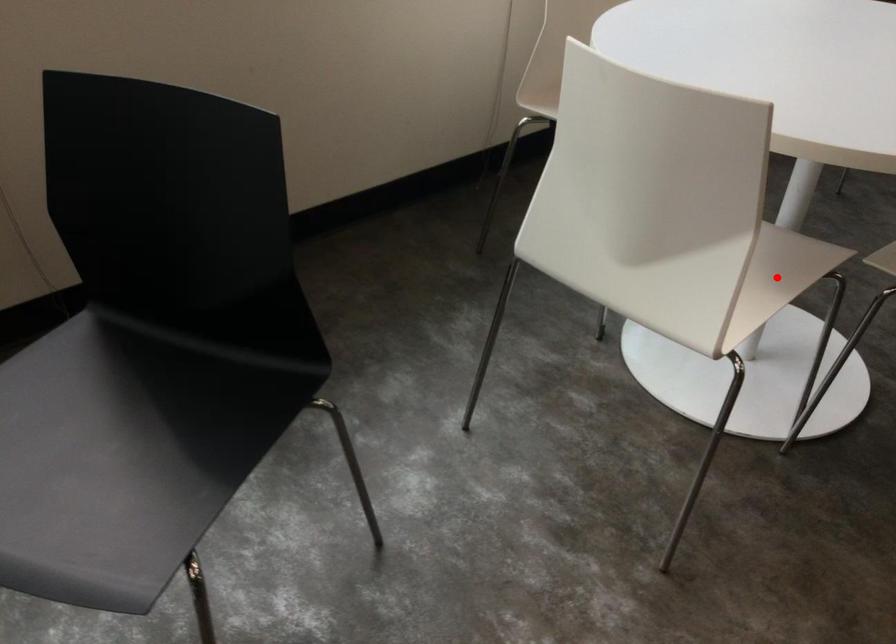
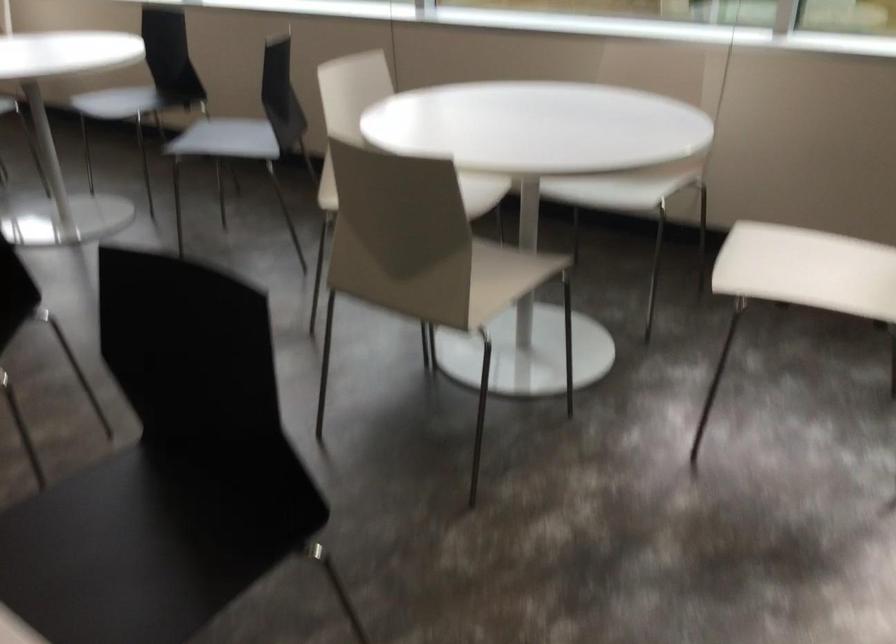
Question: I am providing you with two images of the same scene from different viewpoints. A red point is marked on the first image. At the location where the point appears in image 1, is it still visible in image 2?

Choices:
 (A) Yes
 (B) No

Answer: (B)